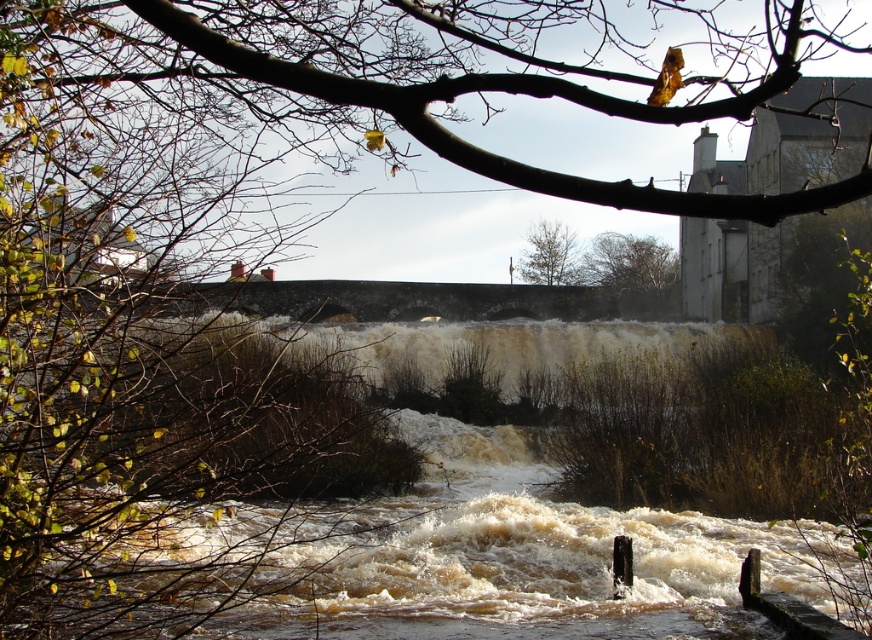
You are a hiker who needs to cross the river using the stone bridge in the background. Your backpack has a 20 feet long rope. If you want to secure the rope between the brown leafy tree at upper center and the green leafy tree at upper center, will the rope be long enough?

The distance between the brown leafy tree at upper center and the green leafy tree at upper center is 22.60 feet. Since the rope is only 20 feet long, it will not be long enough to secure between them.

You are an environmental scientist assessing the riverbank stability. You observe the brown leafy tree at upper center and the green leafy tree at upper center. Which tree has a wider canopy that could potentially provide more root reinforcement against erosion?

The brown leafy tree at upper center has a larger width, meaning its wider canopy provides more root reinforcement against erosion compared to the green leafy tree at upper center.

You are standing on the stone bridge and looking upstream. There are two trees at upper center in the scene. Which tree is closer to you, the brown leafy tree at upper center or the green leafy tree at upper center?

The brown leafy tree at upper center is closer to the viewer than the green leafy tree at upper center, so the brown leafy tree at upper center is closer to you.